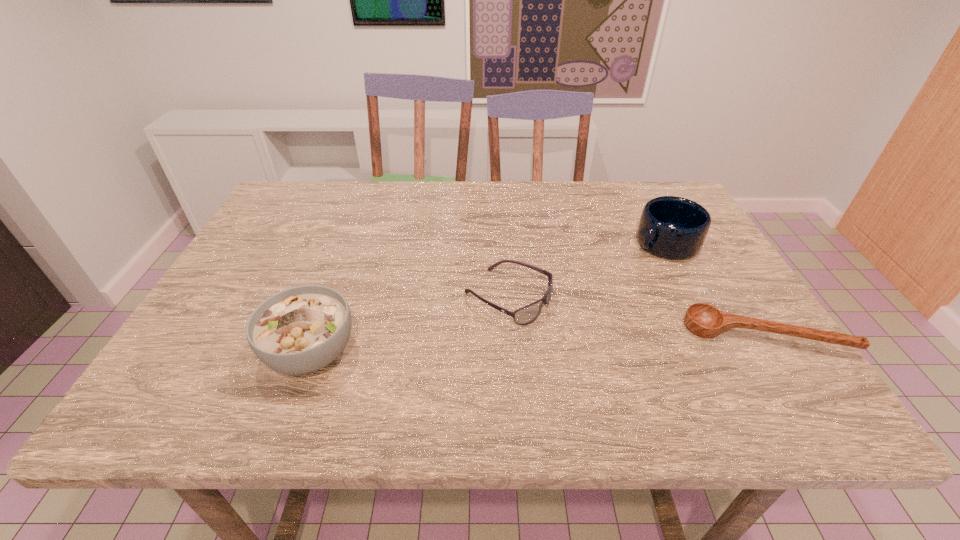
Find the location of `free location at the left edge of the desktop`. free location at the left edge of the desktop is located at coordinates (230, 338).

The image size is (960, 540). In the image, there is a desktop. In order to click on vacant space at the right edge in this screenshot , I will do `click(688, 273)`.

Where is `vacant space at the near right corner`? This screenshot has height=540, width=960. vacant space at the near right corner is located at coordinates (791, 359).

At what (x,y) coordinates should I click in order to perform the action: click on unoccupied area between the mug and the sunglasses. Please return your answer as a coordinate pair (x, y). Looking at the image, I should click on (587, 271).

Locate an element on the screen. Image resolution: width=960 pixels, height=540 pixels. blank region between the soup bowl and the third object from right to left is located at coordinates (410, 325).

Image resolution: width=960 pixels, height=540 pixels. Find the location of `vacant space in between the leftmost object and the farthest object`. vacant space in between the leftmost object and the farthest object is located at coordinates (489, 298).

You are a GUI agent. You are given a task and a screenshot of the screen. Output one action in this format:
    pyautogui.click(x=<x>, y=<y>)
    Task: Click on the free space that is in between the third tallest object and the leftmost object
    The width and height of the screenshot is (960, 540).
    Given the screenshot: What is the action you would take?
    pyautogui.click(x=410, y=325)

At what (x,y) coordinates should I click in order to perform the action: click on free point between the farthest object and the sunglasses. Please return your answer as a coordinate pair (x, y). This screenshot has height=540, width=960. Looking at the image, I should click on (587, 271).

What are the coordinates of `free spot between the leftmost object and the farthest object` in the screenshot? It's located at (489, 298).

Locate an element on the screen. This screenshot has height=540, width=960. free space between the mug and the wooden spoon is located at coordinates tap(715, 289).